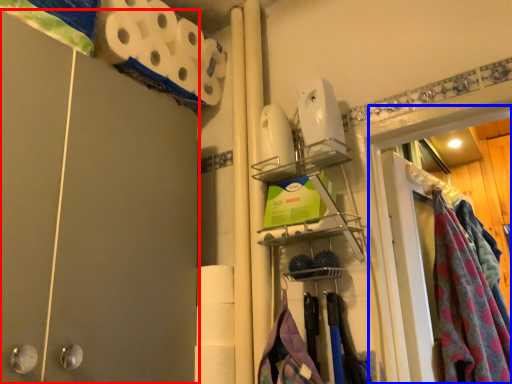
Question: Which of the following is the closest to the observer, barn door (highlighted by a red box) or glass door (highlighted by a blue box)?

Choices:
 (A) barn door
 (B) glass door

Answer: (A)